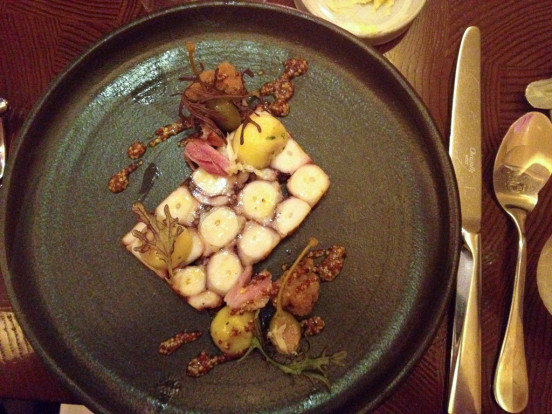
Image resolution: width=552 pixels, height=414 pixels. In order to click on wood table in this screenshot , I will do `click(426, 61)`.